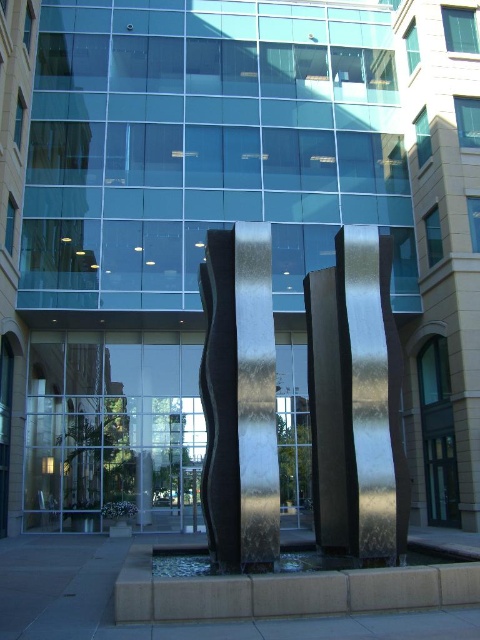
Question: Does polished bronze sculpture at center appear under polished black sculpture at center?

Choices:
 (A) no
 (B) yes

Answer: (A)

Question: Is polished bronze sculpture at center further to the viewer compared to polished black sculpture at center?

Choices:
 (A) no
 (B) yes

Answer: (B)

Question: Which point is closer to the camera taking this photo?

Choices:
 (A) (230, 275)
 (B) (381, 524)

Answer: (B)

Question: Which of the following is the closest to the observer?

Choices:
 (A) polished bronze sculpture at center
 (B) polished black sculpture at center

Answer: (B)

Question: Does polished bronze sculpture at center appear under polished black sculpture at center?

Choices:
 (A) yes
 (B) no

Answer: (B)

Question: Which of the following is the farthest from the observer?

Choices:
 (A) (247, 307)
 (B) (381, 317)

Answer: (B)